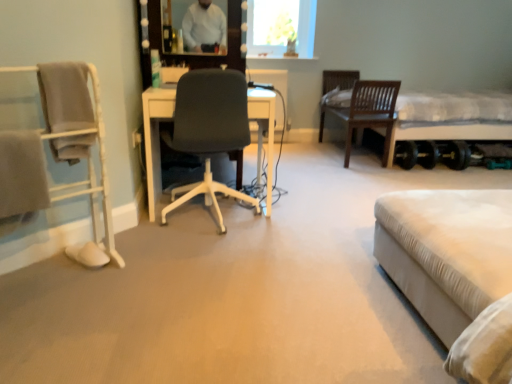
I want to click on vacant area located to the right-hand side of white fabric chair at left, which is the 1th chair from front to back, so click(x=135, y=287).